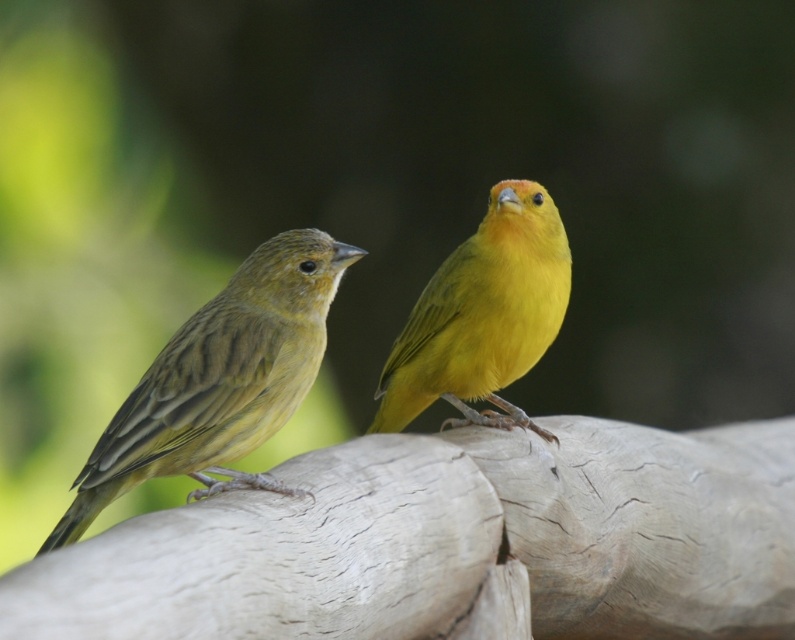
Question: Is matte yellow bird at left positioned behind matte yellow canary at center?

Choices:
 (A) yes
 (B) no

Answer: (B)

Question: Can you confirm if matte yellow bird at left is smaller than matte yellow canary at center?

Choices:
 (A) yes
 (B) no

Answer: (A)

Question: From the image, what is the correct spatial relationship of matte yellow bird at left in relation to matte yellow canary at center?

Choices:
 (A) right
 (B) left

Answer: (B)

Question: Among these objects, which one is nearest to the camera?

Choices:
 (A) matte yellow canary at center
 (B) matte yellow bird at left

Answer: (B)

Question: Which of the following is the farthest from the observer?

Choices:
 (A) matte yellow canary at center
 (B) matte yellow bird at left

Answer: (A)

Question: Which object appears farthest from the camera in this image?

Choices:
 (A) matte yellow bird at left
 (B) matte yellow canary at center

Answer: (B)